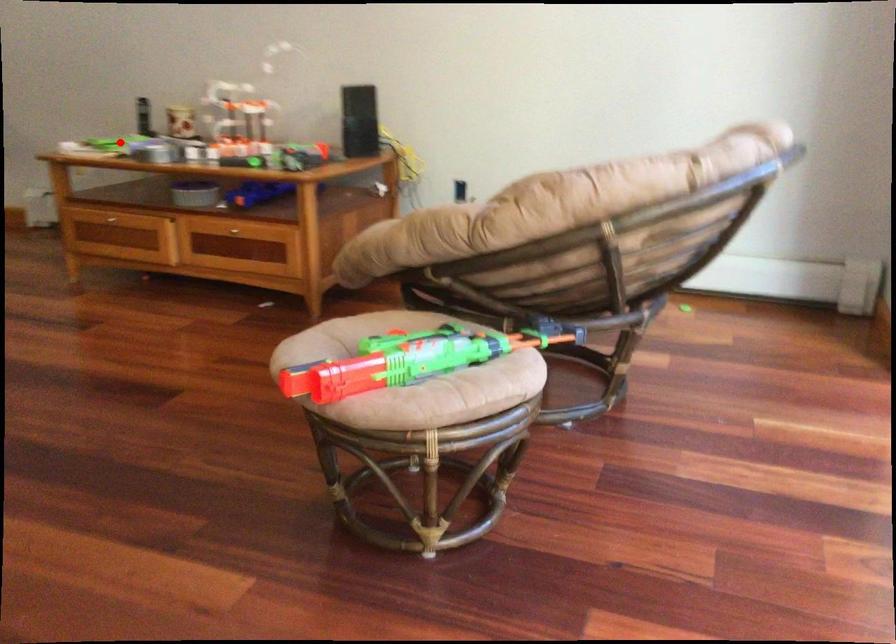
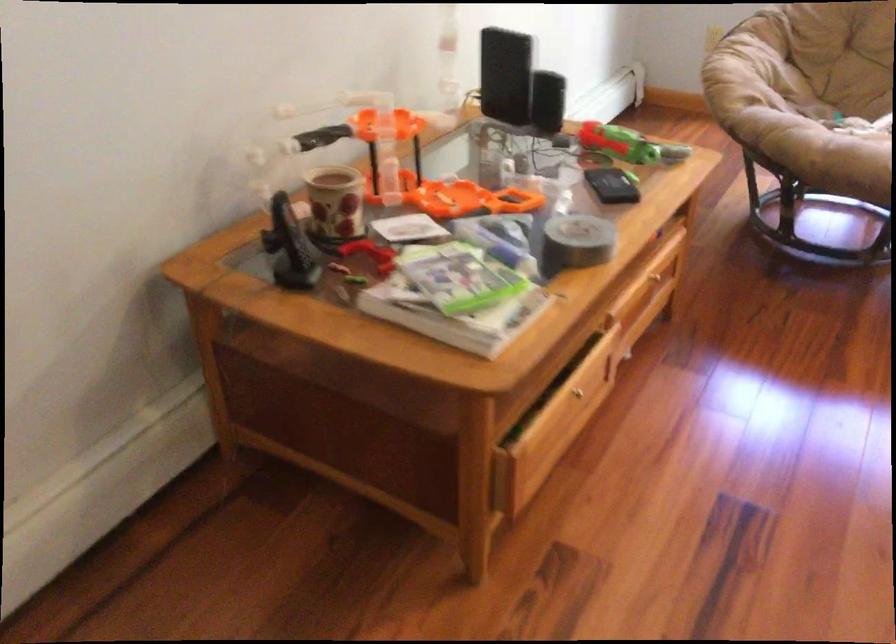
Locate, in the second image, the point that corresponds to the highlighted location in the first image.

(459, 277)